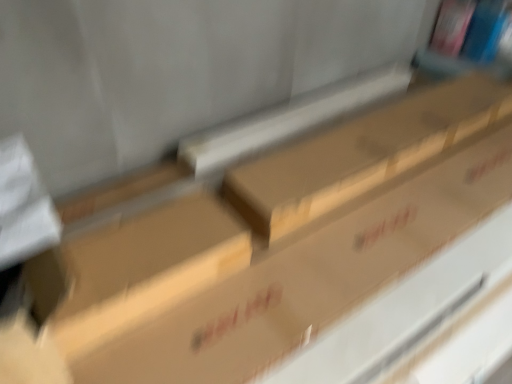
Question: From the image's perspective, is brown cardboard box at center positioned above or below brown cardboard box at center?

Choices:
 (A) below
 (B) above

Answer: (A)

Question: Is brown cardboard box at center in front of or behind brown cardboard box at center in the image?

Choices:
 (A) behind
 (B) front

Answer: (B)

Question: Is brown cardboard box at center bigger or smaller than brown cardboard box at center?

Choices:
 (A) small
 (B) big

Answer: (A)

Question: Considering the positions of brown cardboard box at center and brown cardboard box at center in the image, is brown cardboard box at center wider or thinner than brown cardboard box at center?

Choices:
 (A) thin
 (B) wide

Answer: (A)

Question: Is brown cardboard box at center to the left or to the right of brown cardboard box at center in the image?

Choices:
 (A) right
 (B) left

Answer: (A)

Question: Based on their sizes in the image, would you say brown cardboard box at center is bigger or smaller than brown cardboard box at center?

Choices:
 (A) big
 (B) small

Answer: (A)

Question: From the image's perspective, is brown cardboard box at center above or below brown cardboard box at center?

Choices:
 (A) below
 (B) above

Answer: (B)